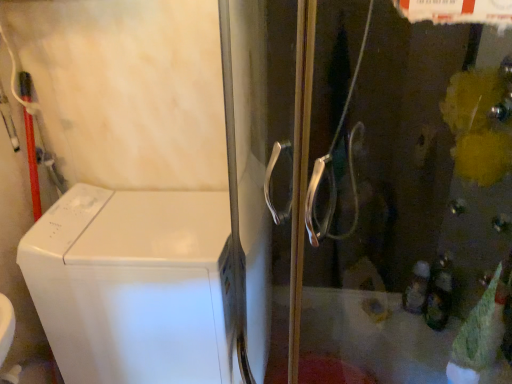
Question: From a real-world perspective, does white glossy washing machine at left stand above transparent glass screen door at center?

Choices:
 (A) no
 (B) yes

Answer: (A)

Question: Is white glossy washing machine at left located outside transparent glass screen door at center?

Choices:
 (A) no
 (B) yes

Answer: (B)

Question: Can you confirm if white glossy washing machine at left is taller than transparent glass screen door at center?

Choices:
 (A) no
 (B) yes

Answer: (A)

Question: Is white glossy washing machine at left closer to the viewer compared to transparent glass screen door at center?

Choices:
 (A) yes
 (B) no

Answer: (B)

Question: Can you confirm if white glossy washing machine at left is wider than transparent glass screen door at center?

Choices:
 (A) yes
 (B) no

Answer: (B)

Question: Are white glossy washing machine at left and transparent glass screen door at center far apart?

Choices:
 (A) no
 (B) yes

Answer: (A)

Question: Could white glossy washing machine at left be considered to be inside transparent glass screen door at center?

Choices:
 (A) no
 (B) yes

Answer: (A)

Question: Is transparent glass screen door at center taller than white glossy washing machine at left?

Choices:
 (A) yes
 (B) no

Answer: (A)

Question: Is transparent glass screen door at center further to camera compared to white glossy washing machine at left?

Choices:
 (A) no
 (B) yes

Answer: (A)

Question: Is transparent glass screen door at center shorter than white glossy washing machine at left?

Choices:
 (A) no
 (B) yes

Answer: (A)

Question: From a real-world perspective, is transparent glass screen door at center located beneath white glossy washing machine at left?

Choices:
 (A) yes
 (B) no

Answer: (B)

Question: Is transparent glass screen door at center oriented towards white glossy washing machine at left?

Choices:
 (A) yes
 (B) no

Answer: (B)

Question: From the image's perspective, is white glossy washing machine at left above or below transparent glass screen door at center?

Choices:
 (A) above
 (B) below

Answer: (B)